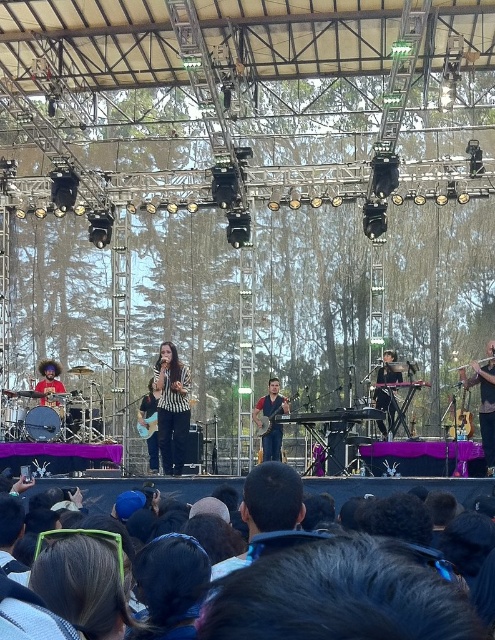
You are a photographer at the concert and want to capture a shot that includes both the dark hair at lower center and the striped fabric at center. Based on their positions, which one should you focus on first to ensure both are in frame?

The dark hair at lower center is positioned on the right side of striped fabric at center, so you should focus on the striped fabric at center first to ensure both are in frame.

Looking at this image, you are a photographer at the outdoor concert and want to capture a shot of the dark hair at lower center and the wooden acoustic guitar at center. Based on their positions, which object is positioned to the right side of the other?

The dark hair at lower center is positioned to the right of the wooden acoustic guitar at center.

You are a stagehand who needs to move the striped fabric at center and the wooden acoustic guitar at center closer together for the performance. How much distance do you need to reduce between them to make them touch each other?

The striped fabric at center and wooden acoustic guitar at center are currently 10.80 feet apart. To make them touch, you need to reduce the distance between them by 10.80 feet.